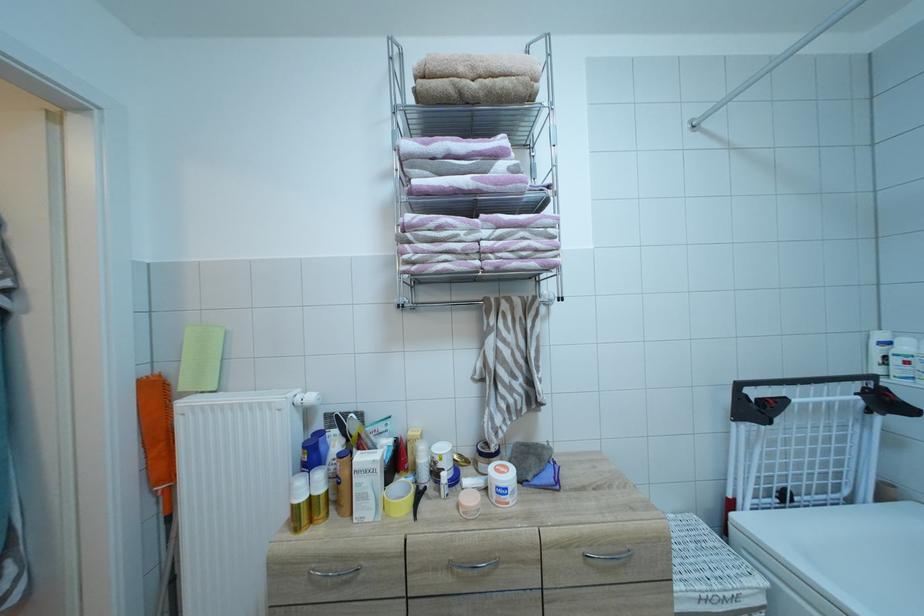
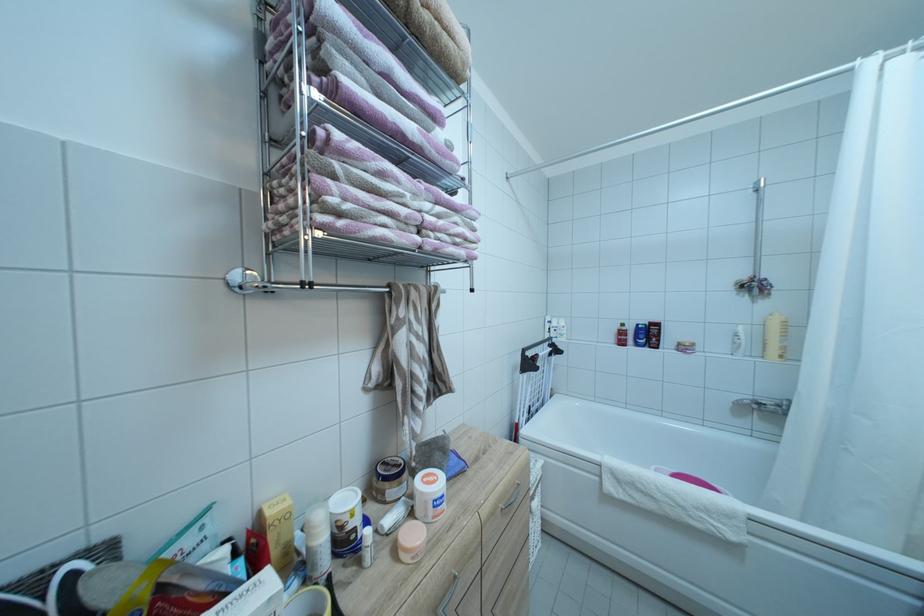
Locate, in the second image, the point that corresponds to the point at 511,477 in the first image.

(442, 487)